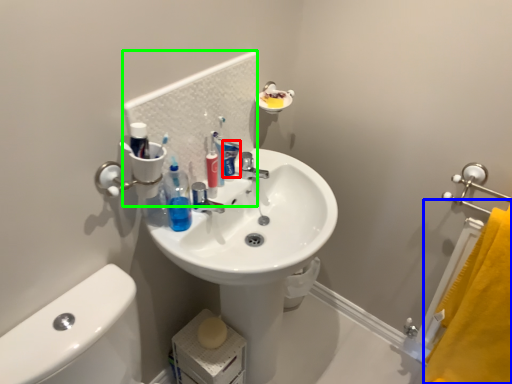
Question: Which object is positioned closest to toothpaste (highlighted by a red box)? Select from bath towel (highlighted by a blue box) and mirror (highlighted by a green box).

Choices:
 (A) bath towel
 (B) mirror

Answer: (B)